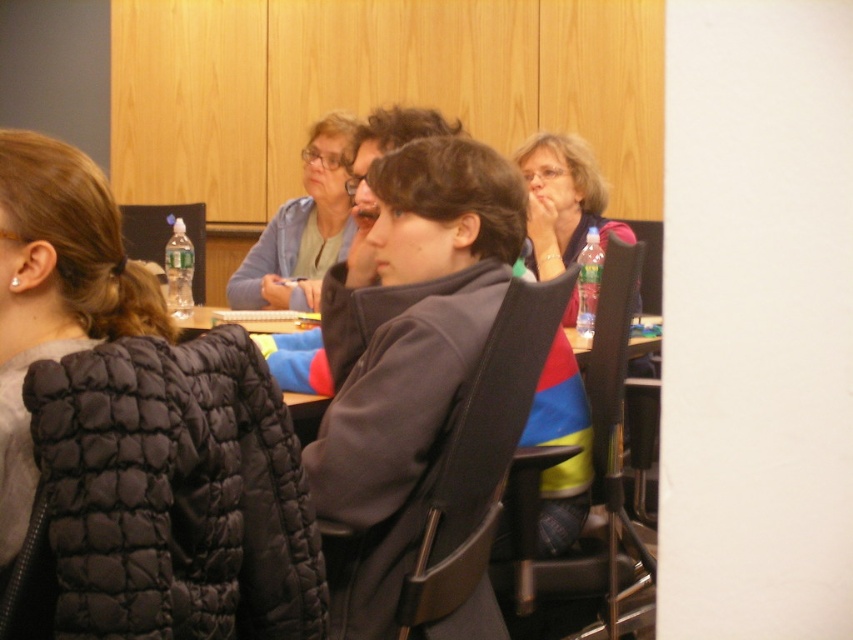
Question: Which point is farther from the camera taking this photo?

Choices:
 (A) (164, 244)
 (B) (613, 552)
 (C) (234, 518)
 (D) (332, 481)

Answer: (A)

Question: Which point is closer to the camera?

Choices:
 (A) (22, 380)
 (B) (199, 276)
 (C) (604, 580)
 (D) (543, 410)

Answer: (A)

Question: Considering the real-world distances, which object is farthest from the clear plastic bottle at upper left?

Choices:
 (A) black plastic chair at center
 (B) matte blue sweater at upper center

Answer: (A)

Question: Is black plastic chair at center wider than matte blue sweater at upper center?

Choices:
 (A) no
 (B) yes

Answer: (A)

Question: Does black quilted jacket at lower left appear under matte blue sweater at upper center?

Choices:
 (A) no
 (B) yes

Answer: (B)

Question: Does black quilted jacket at lower left appear on the left side of clear plastic bottle at upper left?

Choices:
 (A) yes
 (B) no

Answer: (B)